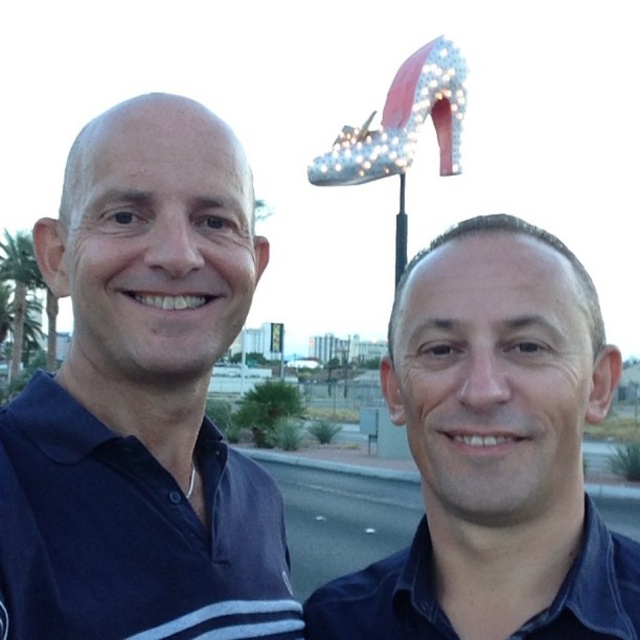
Can you confirm if blue cotton polo shirt at left is wider than green leafy palm tree at left?

In fact, blue cotton polo shirt at left might be narrower than green leafy palm tree at left.

Does blue cotton polo shirt at left appear on the right side of green leafy palm tree at left?

Yes, blue cotton polo shirt at left is to the right of green leafy palm tree at left.

Is point (179, 372) positioned after point (20, 288)?

No, (179, 372) is closer to viewer.

At what (x,y) coordinates should I click in order to perform the action: click on blue cotton polo shirt at left. Please return your answer as a coordinate pair (x, y). Looking at the image, I should click on (141, 401).

Does navy blue cotton polo shirt at center have a greater width compared to green leafy palm tree at left?

No, navy blue cotton polo shirt at center is not wider than green leafy palm tree at left.

Does navy blue cotton polo shirt at center appear over green leafy palm tree at left?

Incorrect, navy blue cotton polo shirt at center is not positioned above green leafy palm tree at left.

Who is more forward, (40, 381) or (1, 266)?

Point (40, 381) is in front.

Where is `navy blue cotton polo shirt at center`? This screenshot has width=640, height=640. navy blue cotton polo shirt at center is located at coordinates (132, 532).

Between blue cotton polo shirt at left and navy blue cotton polo shirt at center, which one appears on the left side from the viewer's perspective?

Positioned to the left is blue cotton polo shirt at left.

Who is lower down, blue cotton polo shirt at left or navy blue cotton polo shirt at center?

navy blue cotton polo shirt at center is lower down.

I want to click on blue cotton polo shirt at left, so click(141, 401).